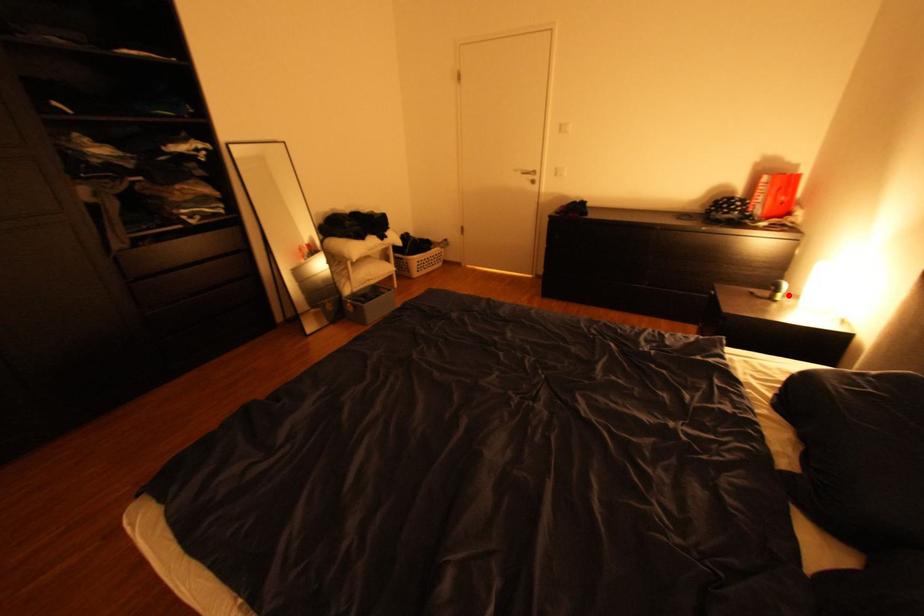
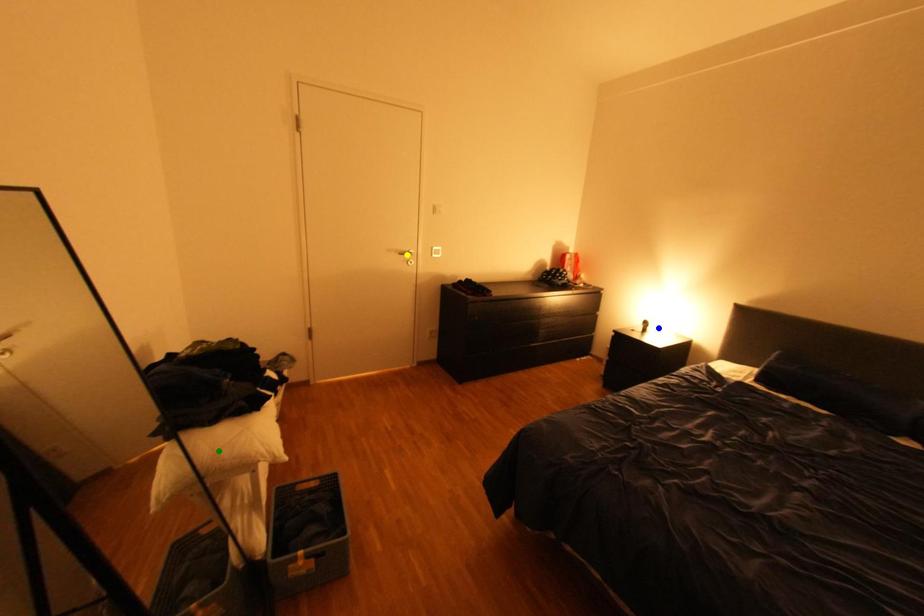
Question: I am providing you with two images of the same scene from different viewpoints. A red point is marked on the first image. You are given multiple points on the second image. In image 2, which mark is for the same physical point as the one in image 1?

Choices:
 (A) blue point
 (B) green point
 (C) yellow point

Answer: (A)